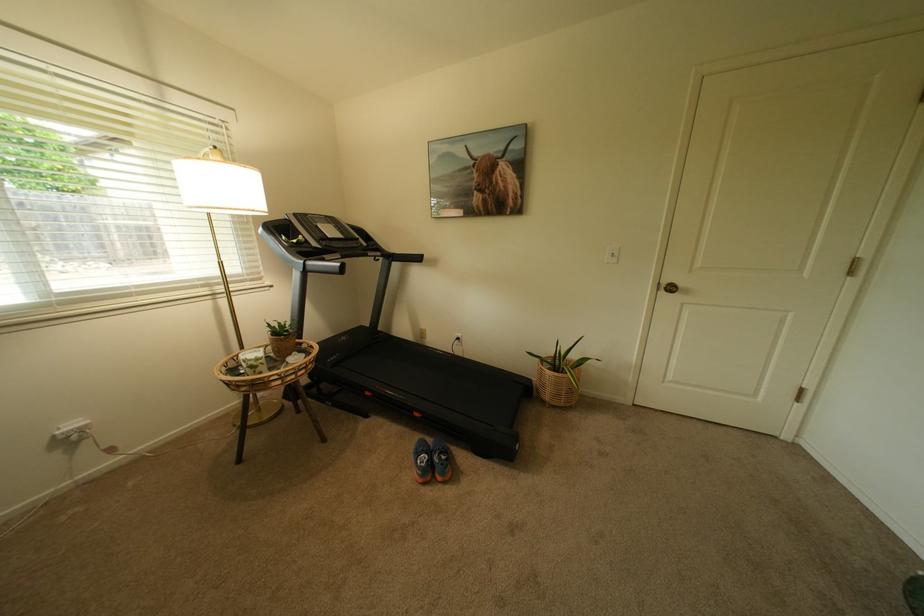
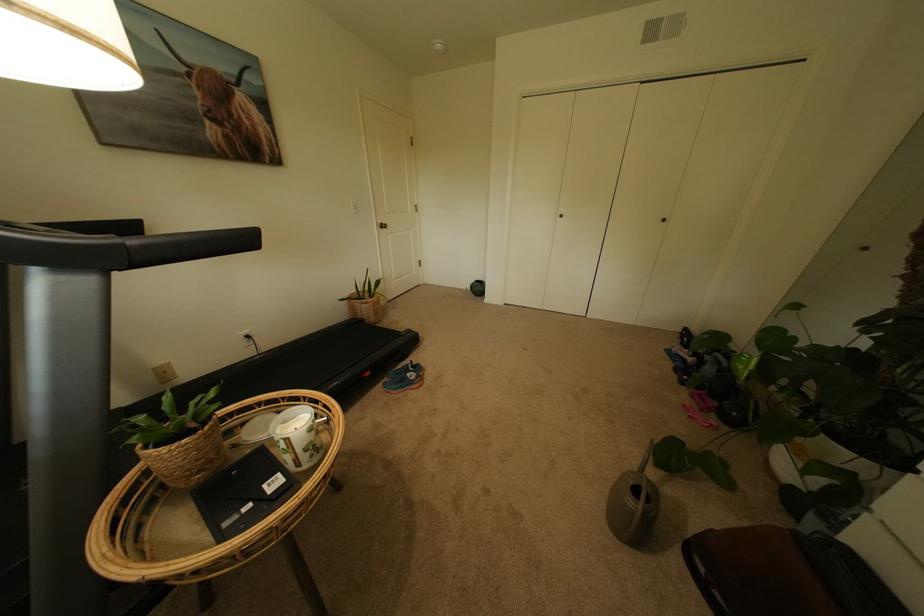
The point at (481, 180) is marked in the first image. Where is the corresponding point in the second image?

(204, 100)